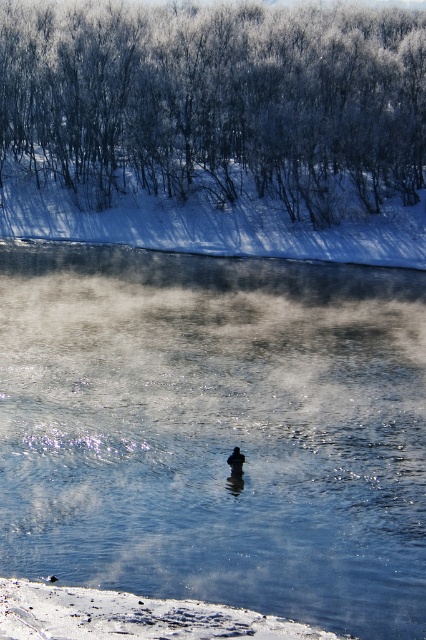
Based on the photo, you are standing at the edge of the water in the winter scene. There is a point marked at coordinates (216,429) which indicates clear ice water at center. If you want to reach the clear ice water at center without walking on the melted ice areas, which direction should you move from your current position at the water edge?

The point marked at (216,429) indicates clear ice water at center. Since the foreground shows partially melted ice at the water edge, moving towards the center from the edge would lead you directly to the clear ice water at center without stepping on melted areas.

You are a photographer trying to capture the dark brown duck at center in the image. Since the clear ice water at center is bigger than the duck, where should you position your camera to ensure the duck is clearly visible in the photo?

To ensure the dark brown duck at center is clearly visible, position your camera closer to the duck since the clear ice water at center is larger and might obscure it if you are too far away.